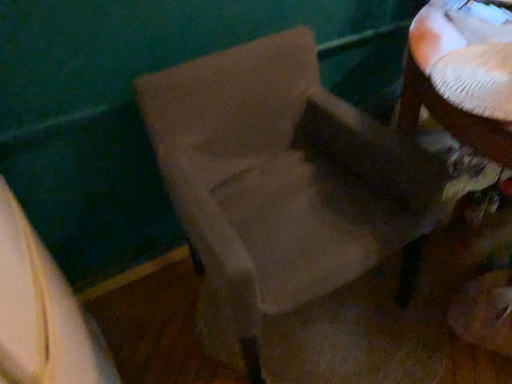
This screenshot has height=384, width=512. What do you see at coordinates (298, 214) in the screenshot?
I see `suede-like beige chair at center` at bounding box center [298, 214].

Where is `white textured table at upper right`? The image size is (512, 384). white textured table at upper right is located at coordinates (458, 96).

From a real-world perspective, is white fabric at lower left beneath white textured table at upper right?

Yes, from a real-world perspective, white fabric at lower left is below white textured table at upper right.

Is white fabric at lower left taller than white textured table at upper right?

Yes.

Who is more distant, white fabric at lower left or white textured table at upper right?

white textured table at upper right.

Visually, is white fabric at lower left positioned to the left or to the right of white textured table at upper right?

A: white fabric at lower left is positioned on white textured table at upper right's left side.

Identify the location of chair in front of the white textured table at upper right. (298, 214).

Does suede-like beige chair at center have a lesser height compared to white textured table at upper right?

In fact, suede-like beige chair at center may be taller than white textured table at upper right.

From the image's perspective, is suede-like beige chair at center on top of white textured table at upper right?

Actually, suede-like beige chair at center appears below white textured table at upper right in the image.

Based on the photo, considering the relative sizes of suede-like beige chair at center and white textured table at upper right in the image provided, is suede-like beige chair at center thinner than white textured table at upper right?

No.

From a real-world perspective, does suede-like beige chair at center stand above white fabric at lower left?

No, from a real-world perspective, suede-like beige chair at center is not above white fabric at lower left.

How much distance is there between suede-like beige chair at center and white fabric at lower left?

suede-like beige chair at center and white fabric at lower left are 48.84 centimeters apart from each other.

Is suede-like beige chair at center outside of white fabric at lower left?

Indeed, suede-like beige chair at center is completely outside white fabric at lower left.

Is suede-like beige chair at center next to white fabric at lower left and touching it?

suede-like beige chair at center and white fabric at lower left are not in contact.

Would you say white textured table at upper right is inside or outside suede-like beige chair at center?

white textured table at upper right is outside suede-like beige chair at center.

What's the angular difference between white textured table at upper right and suede-like beige chair at center's facing directions?

84.5 degrees.

Considering the sizes of objects white textured table at upper right and suede-like beige chair at center in the image provided, who is smaller, white textured table at upper right or suede-like beige chair at center?

white textured table at upper right is smaller.

Is white fabric at lower left taller or shorter than suede-like beige chair at center?

In the image, white fabric at lower left appears to be taller than suede-like beige chair at center.

Find the location of a particular element. This screenshot has height=384, width=512. leftover located above the suede-like beige chair at center (from a real-world perspective) is located at coordinates (42, 313).

From the image's perspective, which one is positioned higher, white fabric at lower left or suede-like beige chair at center?

suede-like beige chair at center, from the image's perspective.

From a real-world perspective, between white fabric at lower left and suede-like beige chair at center, who is vertically higher?

white fabric at lower left.

Locate an element on the screen. This screenshot has width=512, height=384. leftover that is below the white textured table at upper right (from the image's perspective) is located at coordinates (42, 313).

Can you confirm if white textured table at upper right is positioned to the left of white fabric at lower left?

No, white textured table at upper right is not to the left of white fabric at lower left.

Who is more distant, white textured table at upper right or white fabric at lower left?

white textured table at upper right is behind.

From the image's perspective, is white textured table at upper right located above or below white fabric at lower left?

white textured table at upper right is situated higher than white fabric at lower left in the image.

The image size is (512, 384). I want to click on table behind the white fabric at lower left, so click(x=458, y=96).

Identify the location of chair lying in front of the white textured table at upper right. The height and width of the screenshot is (384, 512). (298, 214).

Based on their spatial positions, is suede-like beige chair at center or white textured table at upper right further from white fabric at lower left?

white textured table at upper right is positioned further to the anchor white fabric at lower left.

Considering their positions, is white fabric at lower left positioned further to white textured table at upper right than suede-like beige chair at center?

white fabric at lower left.

Estimate the real-world distances between objects in this image. Which object is further from suede-like beige chair at center, white fabric at lower left or white textured table at upper right?

Among the two, white fabric at lower left is located further to suede-like beige chair at center.

When comparing their distances from suede-like beige chair at center, does white textured table at upper right or white fabric at lower left seem further?

white fabric at lower left is further to suede-like beige chair at center.

Which object lies nearer to the anchor point white textured table at upper right, suede-like beige chair at center or white fabric at lower left?

suede-like beige chair at center is positioned closer to the anchor white textured table at upper right.

When comparing their distances from white fabric at lower left, does white textured table at upper right or suede-like beige chair at center seem closer?

suede-like beige chair at center lies closer to white fabric at lower left than the other object.

This screenshot has width=512, height=384. Identify the location of chair situated between white fabric at lower left and white textured table at upper right from left to right. (298, 214).